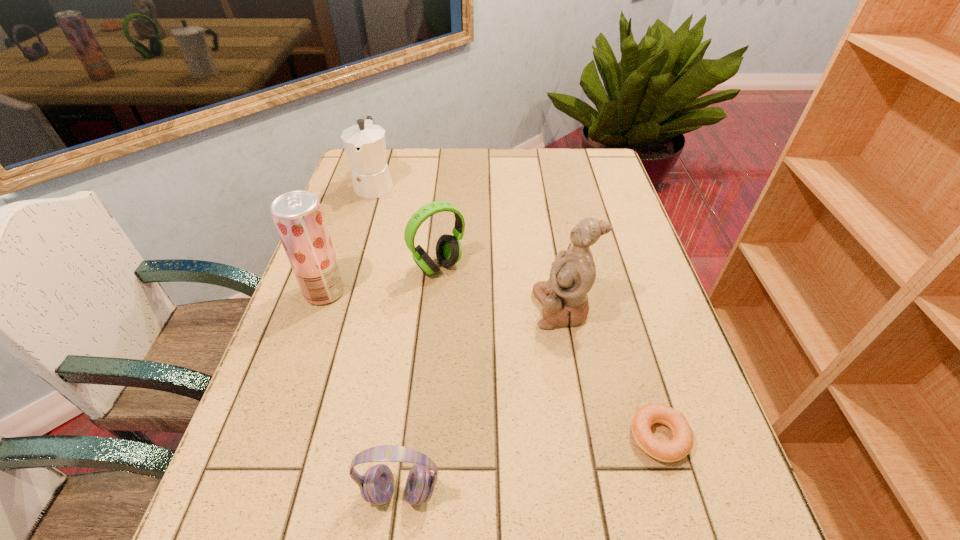
The width and height of the screenshot is (960, 540). In order to click on object present at the far left corner in this screenshot , I will do `click(365, 145)`.

Where is `vacant space at the far edge`? vacant space at the far edge is located at coordinates (404, 172).

Where is `vacant space at the left edge of the desktop`? vacant space at the left edge of the desktop is located at coordinates (300, 416).

I want to click on free space at the right edge of the desktop, so click(631, 256).

The image size is (960, 540). In order to click on blank area at the far right corner in this screenshot , I will do `click(572, 160)`.

The height and width of the screenshot is (540, 960). Find the location of `free space between the second object from right to left and the farther headset`. free space between the second object from right to left and the farther headset is located at coordinates (500, 287).

At what (x,y) coordinates should I click in order to perform the action: click on vacant area between the shorter headset and the fifth farthest object. Please return your answer as a coordinate pair (x, y). Image resolution: width=960 pixels, height=540 pixels. Looking at the image, I should click on coord(530,464).

Where is `empty location between the shortest object and the second shortest object`? The height and width of the screenshot is (540, 960). empty location between the shortest object and the second shortest object is located at coordinates (530, 464).

This screenshot has width=960, height=540. I want to click on empty location between the farther headset and the fruit juice, so click(x=382, y=279).

At what (x,y) coordinates should I click in order to perform the action: click on free area in between the nearer headset and the shortest object. Please return your answer as a coordinate pair (x, y). Image resolution: width=960 pixels, height=540 pixels. Looking at the image, I should click on (530, 464).